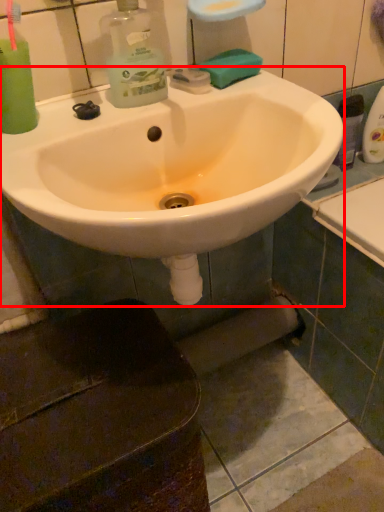
Question: In this image, where is sink (annotated by the red box) located relative to soap?

Choices:
 (A) right
 (B) left

Answer: (B)